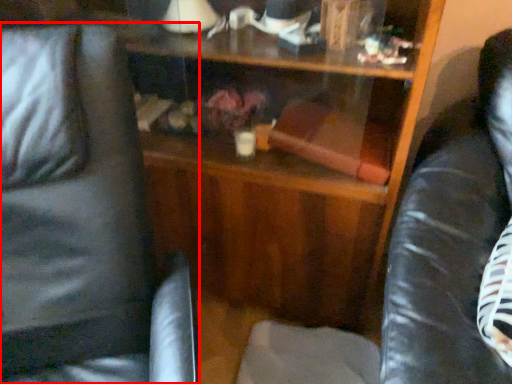
Question: From the image, what is the correct spatial relationship of swivel chair (annotated by the red box) in relation to swivel chair?

Choices:
 (A) left
 (B) right

Answer: (A)